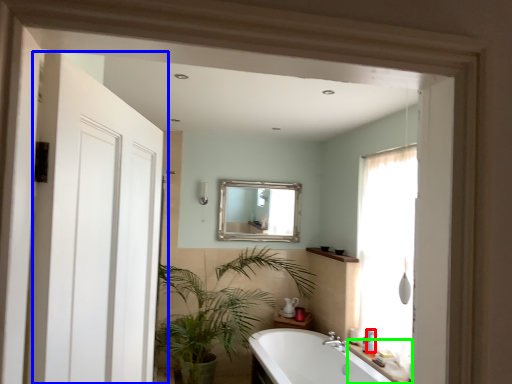
Question: Which object is positioned farthest from toiletry (highlighted by a red box)? Select from door (highlighted by a blue box) and counter top (highlighted by a green box).

Choices:
 (A) door
 (B) counter top

Answer: (A)